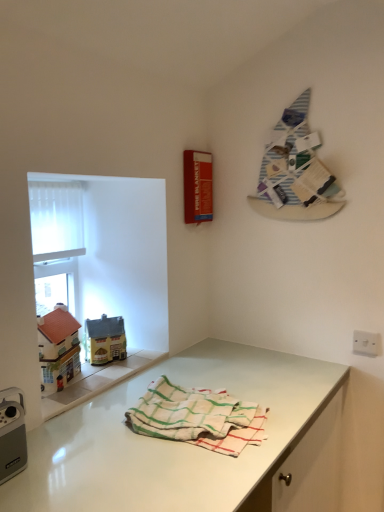
You are a GUI agent. You are given a task and a screenshot of the screen. Output one action in this format:
    pyautogui.click(x=<x>, y=<y>)
    Task: Click on the free spot above white glossy window sill at lower left (from a real-world perspective)
    
    Given the screenshot: What is the action you would take?
    pyautogui.click(x=94, y=373)